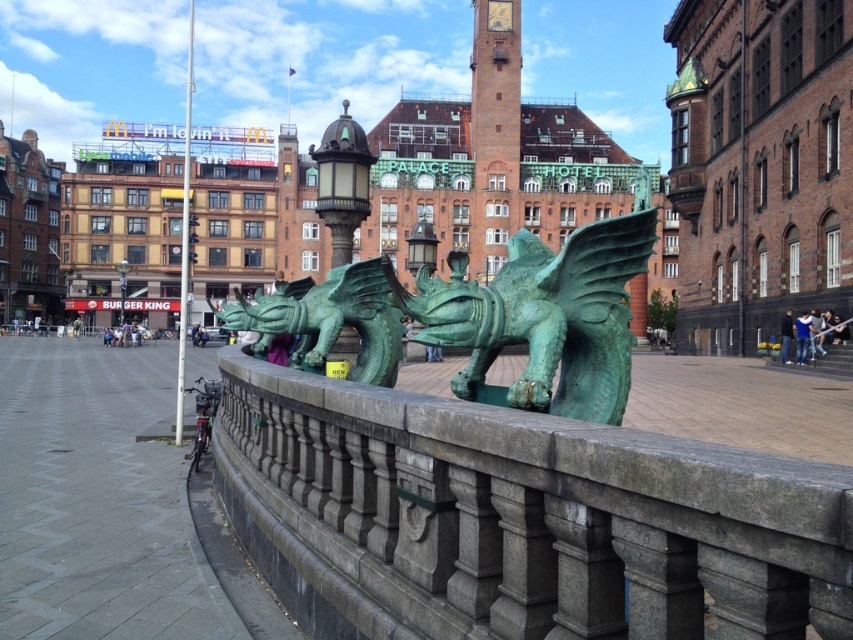
Question: Can you confirm if green stone railing at center is positioned to the right of green patina stone dragon at center?

Choices:
 (A) yes
 (B) no

Answer: (B)

Question: Is green stone railing at center above green patina stone dragon at center?

Choices:
 (A) yes
 (B) no

Answer: (B)

Question: Is green stone railing at center above green patina stone dragon at center?

Choices:
 (A) no
 (B) yes

Answer: (A)

Question: Among these objects, which one is nearest to the camera?

Choices:
 (A) green patina dragon at center
 (B) green patina stone dragon at center

Answer: (B)

Question: Which of these objects is positioned closest to the green stone railing at center?

Choices:
 (A) green patina stone dragon at center
 (B) green patina dragon at center

Answer: (A)

Question: Which of the following is the closest to the observer?

Choices:
 (A) green stone railing at center
 (B) green patina dragon at center

Answer: (A)